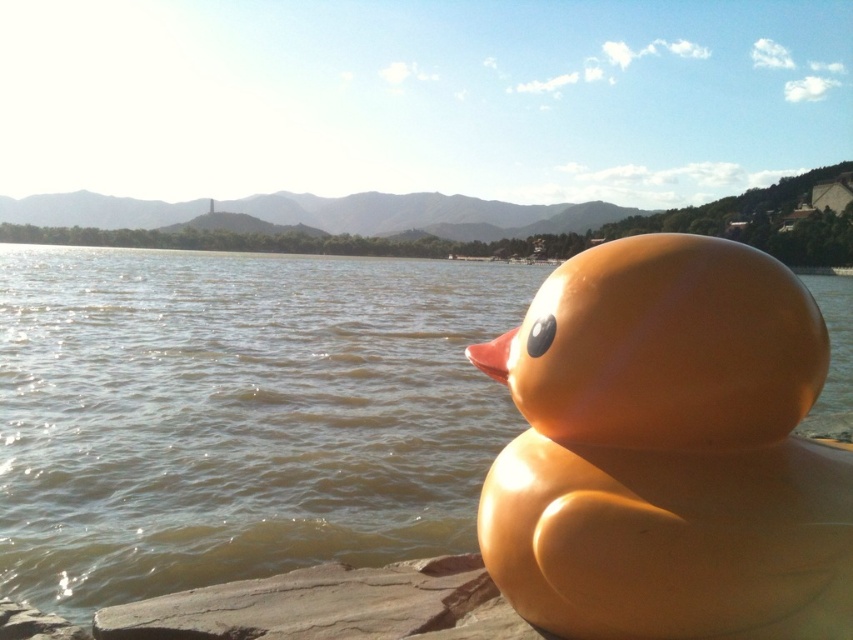
You are standing next to the bright yellow rubber duck and want to place a small floating toy in the water. According to the image, where should you place it to ensure it floats near the translucent water at duck right?

The translucent water at duck right is located at point (238, 413), so you should place the small floating toy near that coordinate to ensure it floats there.

You are standing on the shore and see the glossy rubber duck at right and the translucent water at duck right. Which object is closer to your right side?

The glossy rubber duck at right is closer to your right side because the translucent water at duck right is to the left of it.

Consider the image. You are standing next to the glossy rubber duck at right and want to see the translucent water at duck right. In which direction should you look relative to the duck?

The translucent water at duck right is above the glossy rubber duck at right, so you should look upward to see the translucent water at duck right.